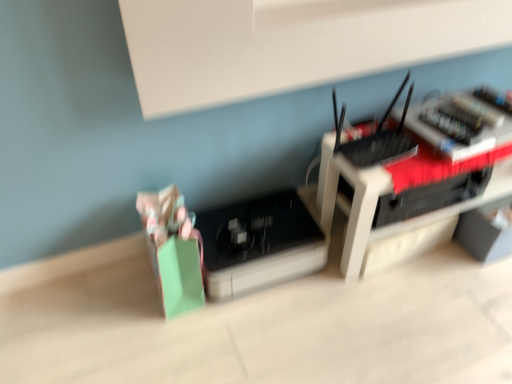
Question: In the image, is black plastic router at center positioned in front of or behind black plastic register at center, placed as the second register when sorted from right to left?

Choices:
 (A) front
 (B) behind

Answer: (A)

Question: Looking at the image, does black plastic router at center seem bigger or smaller compared to black plastic register at center, marked as the first register in a bottom-to-top arrangement?

Choices:
 (A) big
 (B) small

Answer: (A)

Question: Estimate the real-world distances between objects in this image. Which object is farther from the black plastic router at center?

Choices:
 (A) black plastic register at center, marked as the first register in a bottom-to-top arrangement
 (B) black plastic router at upper right, placed as the 2th register when sorted from left to right

Answer: (A)

Question: Based on their relative distances, which object is nearer to the black plastic register at center, the 2th register from the top?

Choices:
 (A) black plastic router at center
 (B) black plastic router at upper right, the first register viewed from the right

Answer: (A)